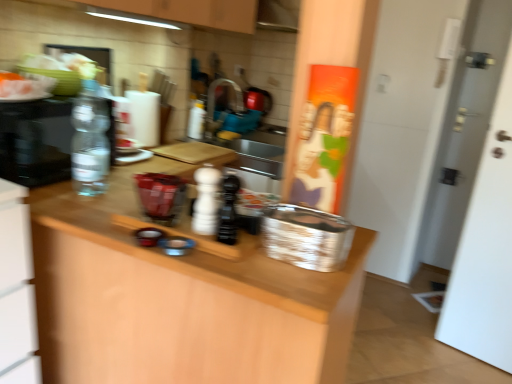
The width and height of the screenshot is (512, 384). Identify the location of vacant location behind transparent plastic bottle at left, which is the 2th bottle from back to front. (119, 175).